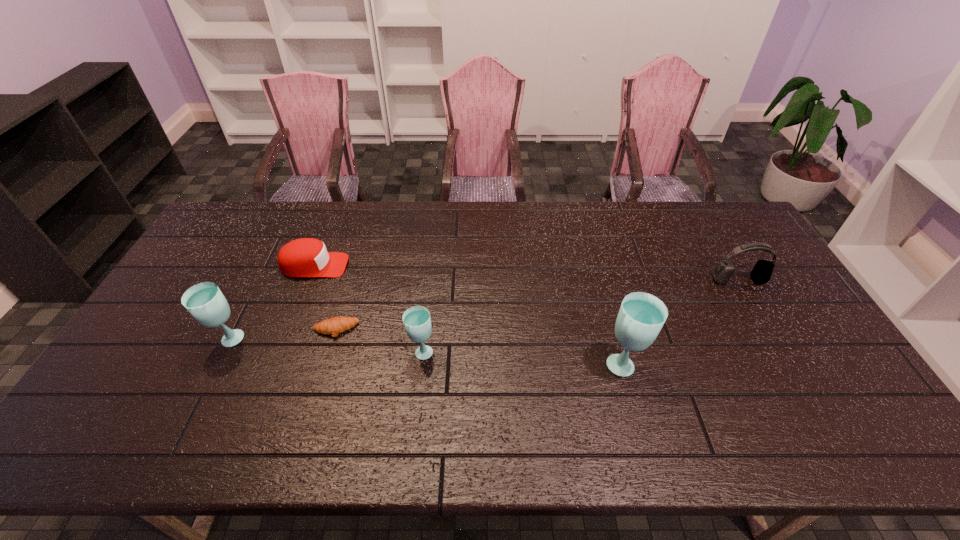
I want to click on the second tallest glass, so click(205, 302).

You are a GUI agent. You are given a task and a screenshot of the screen. Output one action in this format:
    pyautogui.click(x=<x>, y=<y>)
    Task: Click on the fifth shortest object
    
    Given the screenshot: What is the action you would take?
    pyautogui.click(x=205, y=302)

The width and height of the screenshot is (960, 540). Identify the location of the second glass from left to right. (416, 319).

Locate an element on the screen. Image resolution: width=960 pixels, height=540 pixels. the third object from right to left is located at coordinates (416, 319).

Find the location of a particular element. This screenshot has height=540, width=960. the fifth object from left to right is located at coordinates (641, 316).

Locate an element on the screen. the tallest glass is located at coordinates (641, 316).

Find the location of a particular element. This screenshot has height=540, width=960. crescent roll is located at coordinates (335, 325).

You are a GUI agent. You are given a task and a screenshot of the screen. Output one action in this format:
    pyautogui.click(x=<x>, y=<y>)
    Task: Click on the headset
    The width and height of the screenshot is (960, 540).
    Given the screenshot: What is the action you would take?
    pyautogui.click(x=761, y=273)

At what (x,y) coordinates should I click in order to perform the action: click on baseball cap. Please return your answer as a coordinate pair (x, y). Looking at the image, I should click on (307, 257).

This screenshot has height=540, width=960. Identify the location of free space located on the right of the leftmost object. (331, 340).